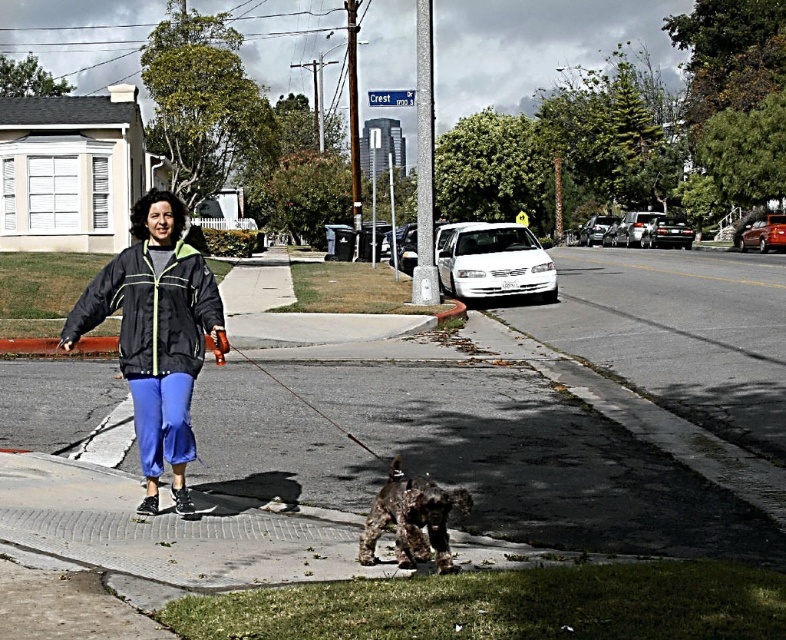
You are a delivery robot that needs to deliver a package to a house on this street. You see the gray concrete sidewalk at center and the matte black jacket at center. Which object should you avoid stepping on to stay on the path?

You should avoid stepping on the matte black jacket at center because the gray concrete sidewalk at center is the path and is larger in size than the matte black jacket at center, indicating it is the proper walking area.

You are a delivery drone flying above the suburban street scene. You need to land on the gray concrete sidewalk at center to deliver a package. However, there is a smooth black leash at center in your path. Can you safely land on the sidewalk without hitting the leash?

The gray concrete sidewalk at center is located below the smooth black leash at center, so the drone can safely land on the sidewalk as it is positioned under the leash and will not interfere with the landing path.